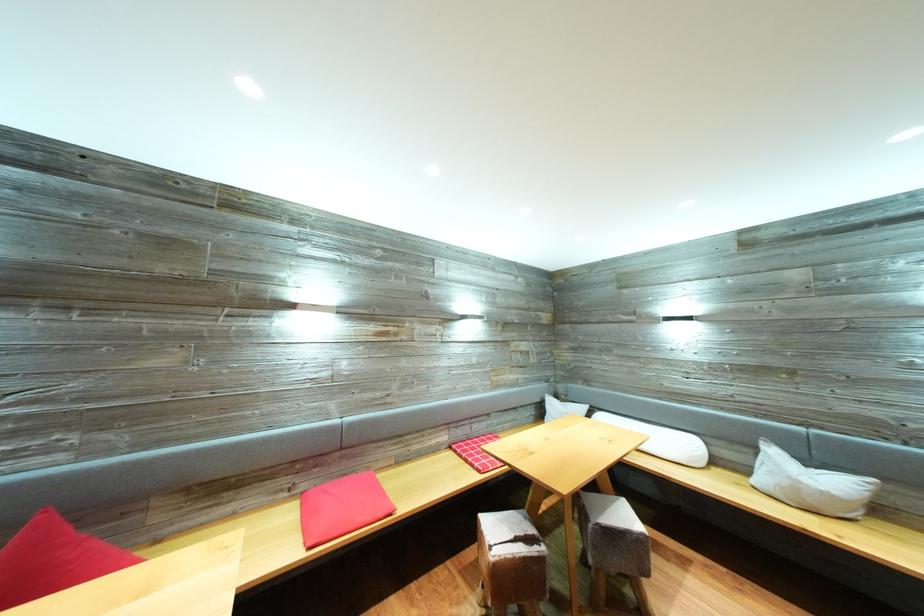
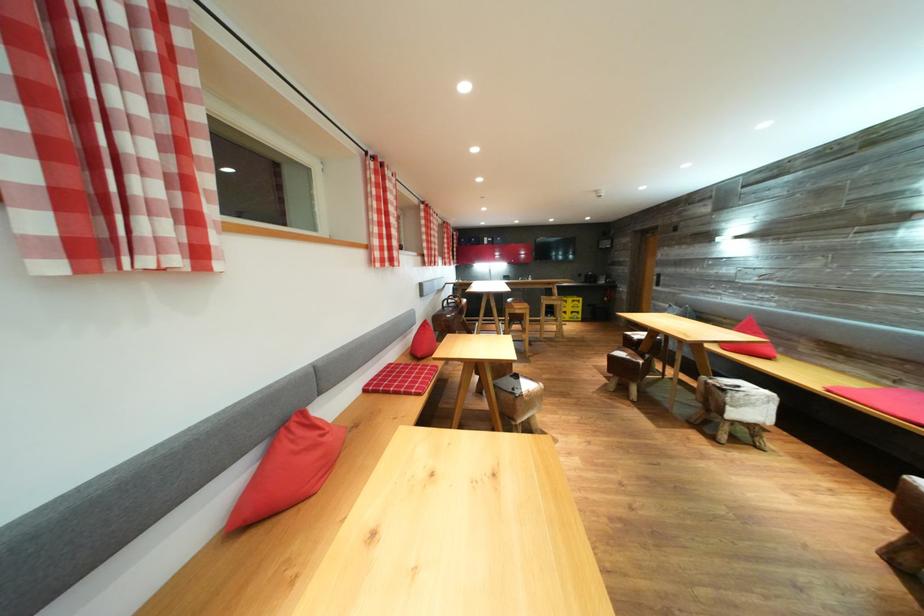
Where in the second image is the point corresponding to point (292, 500) from the first image?

(895, 389)